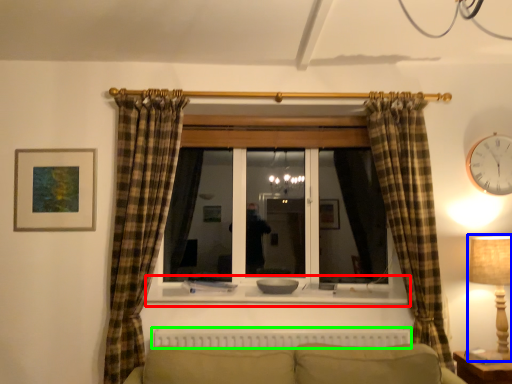
Question: Which object is the closest to the window sill (highlighted by a red box)? Choose among these: table lamp (highlighted by a blue box) or radiator (highlighted by a green box).

Choices:
 (A) table lamp
 (B) radiator

Answer: (B)